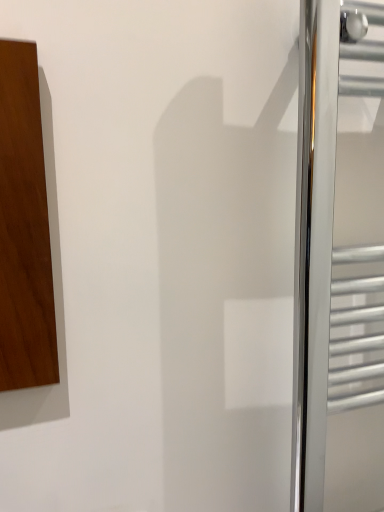
At what (x,y) coordinates should I click in order to perform the action: click on wooden door at left. Please return your answer as a coordinate pair (x, y). The height and width of the screenshot is (512, 384). Looking at the image, I should click on (24, 228).

Describe the element at coordinates (24, 228) in the screenshot. I see `wooden door at left` at that location.

In order to face wooden door at left, should I rotate leftwards or rightwards?

A 39.767 degree turn to the left will do.

The height and width of the screenshot is (512, 384). Identify the location of wooden door at left. (24, 228).